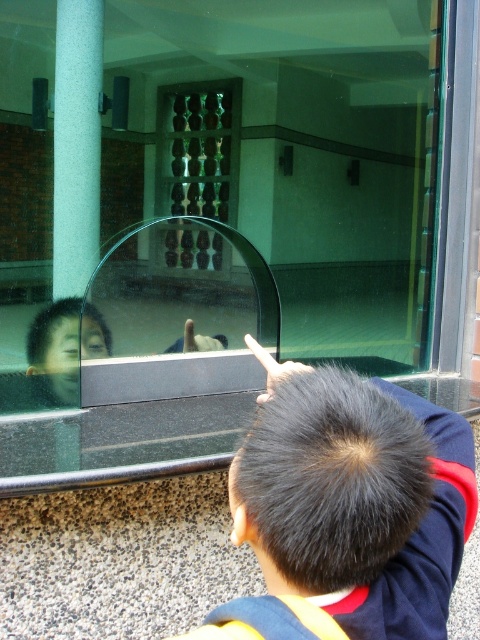
You are an architect designing a new museum layout. You need to ensure that visitors can see both the dark brown hair at upper right and the green textured pillar at left clearly from the entrance. Given their sizes, which object might require additional lighting to ensure visibility?

The dark brown hair at upper right might require additional lighting because it is narrower than the green textured pillar at left, making it potentially less visible from a distance.

You are a visitor at a museum and you want to take a photo of the dark brown hair at upper right and the green textured pillar at left. The museum has a rule that you must keep at least 6 feet away from all exhibits. Can you stand in a position where both objects are in frame without violating the rule?

The dark brown hair at upper right is 7.33 feet from the green textured pillar at left. Since the minimum required distance is 6 feet, you can stand 6 feet away from either object while still capturing both in your photo, as the total distance between them allows for this arrangement without violating the museum rule.

You are a visitor at the scene. You see the dark brown hair at upper right and the green textured pillar at left. Which object takes up more space in the image?

The green textured pillar at left takes up more space in the image because the dark brown hair at upper right occupies less space than it.